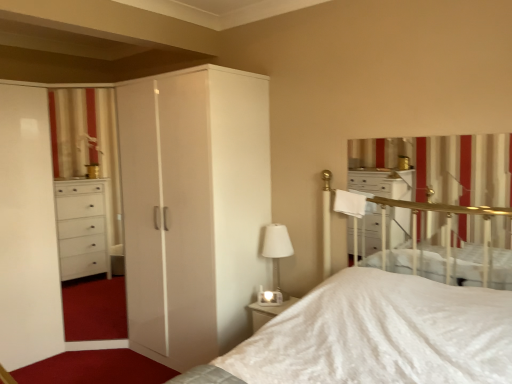
Question: Is white glass table lamp at center to the left or to the right of white striped curtain at upper right in the image?

Choices:
 (A) left
 (B) right

Answer: (A)

Question: From the image's perspective, is white glass table lamp at center positioned above or below white striped curtain at upper right?

Choices:
 (A) above
 (B) below

Answer: (B)

Question: Estimate the real-world distances between objects in this image. Which object is farther from the white glass table lamp at center?

Choices:
 (A) white glossy wardrobe at center
 (B) white striped curtain at upper right

Answer: (B)

Question: Estimate the real-world distances between objects in this image. Which object is closer to the white glass table lamp at center?

Choices:
 (A) white glossy wardrobe at center
 (B) white striped curtain at upper right

Answer: (A)